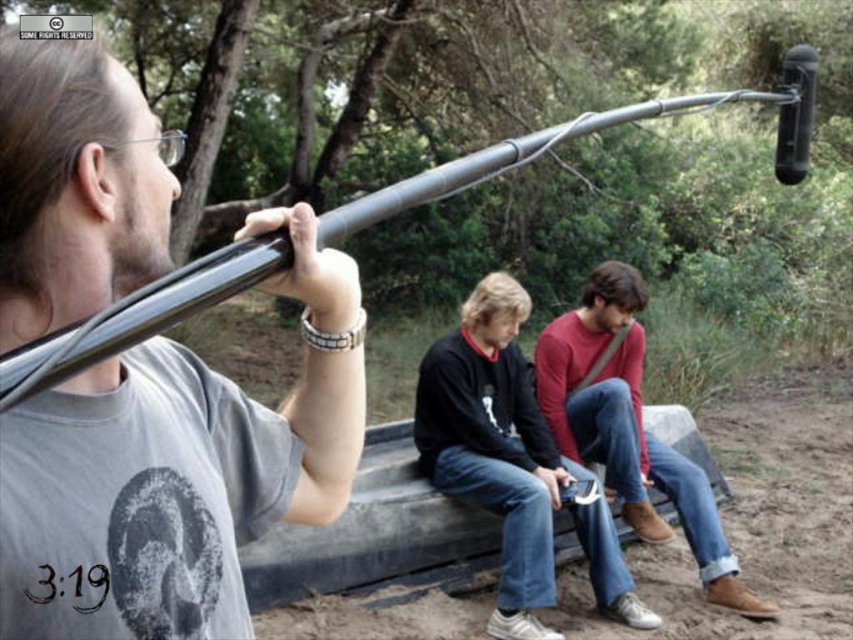
Does dark blue jeans at center have a larger size compared to matte red sweater at center?

No.

Between point (421, 378) and point (729, 573), which one is positioned in front?

Point (421, 378) is more forward.

Does point (508, 468) come behind point (599, 307)?

No.

The image size is (853, 640). I want to click on dark blue jeans at center, so click(512, 464).

Is metallic gray pole at upper left smaller than matte red sweater at center?

Correct, metallic gray pole at upper left occupies less space than matte red sweater at center.

Is metallic gray pole at upper left shorter than matte red sweater at center?

Yes, metallic gray pole at upper left is shorter than matte red sweater at center.

The image size is (853, 640). Describe the element at coordinates (177, 470) in the screenshot. I see `metallic gray pole at upper left` at that location.

Where is `metallic gray pole at upper left`? This screenshot has width=853, height=640. metallic gray pole at upper left is located at coordinates (177, 470).

Who is lower down, metallic gray pole at upper left or dark blue jeans at center?

dark blue jeans at center is below.

Is point (141, 561) more distant than point (498, 488)?

No.

This screenshot has width=853, height=640. I want to click on metallic gray pole at upper left, so click(x=177, y=470).